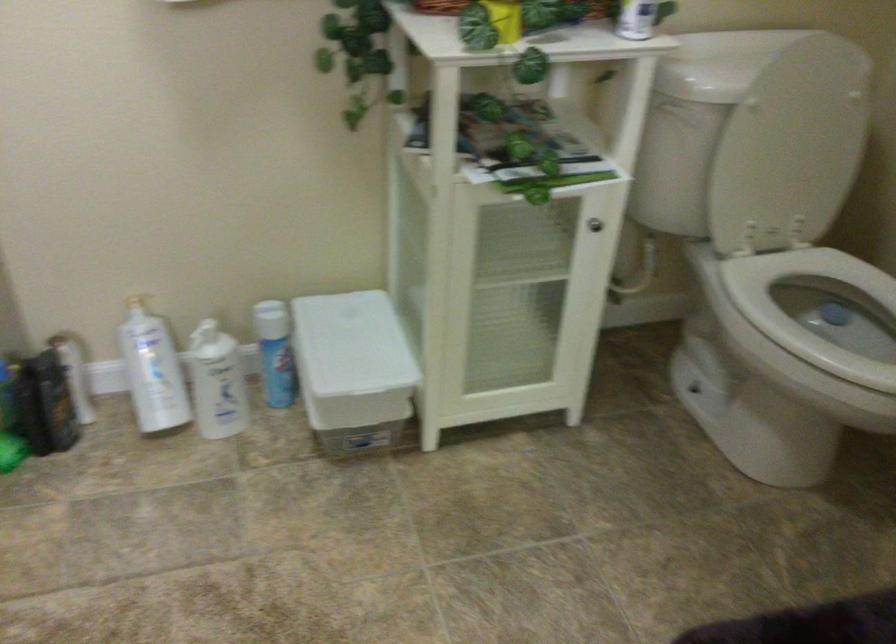
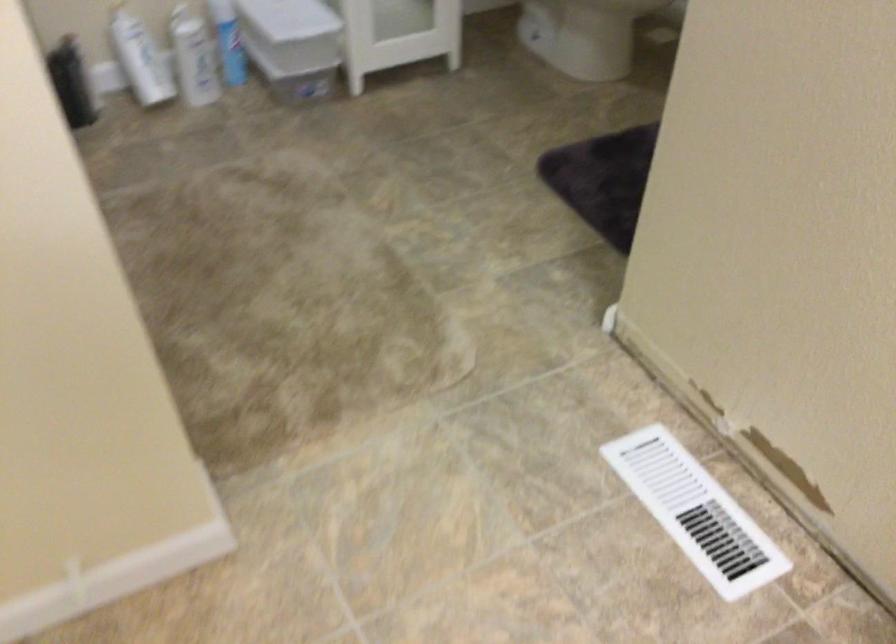
The point at (135, 380) is marked in the first image. Where is the corresponding point in the second image?

(140, 59)